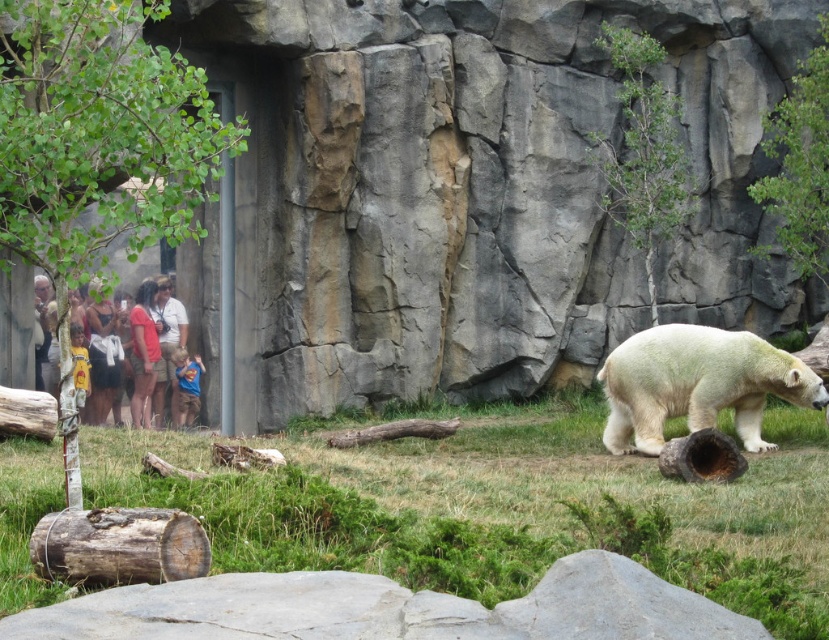
You are a zookeeper who needs to place a new feeding station between the white fur bear at center and the brown rough log at lower left. The feeding station requires a minimum of 5 meters of space to be safely placed. Can you place it between them?

The distance between the white fur bear at center and the brown rough log at lower left is 6.44 meters, which is more than the required 5 meters. Therefore, the feeding station can be safely placed between them.

You are a zookeeper observing the polar bear in its enclosure. You notice a specific point marked at coordinates (697,385). Based on the scene description, where exactly is this point located on the bear?

The point at (697,385) is on the white fur bear at center.

You are standing in front of the zoo enclosure watching the polar bear. You want to take a photo of the polar bear but need to ensure you are far enough away to avoid disturbing it. The zoo requires visitors to stay at least 15 meters away from any animal. Is your current position at point (x=653, y=406) safe for taking the photo?

The point (x=653, y=406) is 17.16 meters away from the camera, which is more than the required 15 meters. Therefore, your current position is safe for taking the photo without disturbing the polar bear.